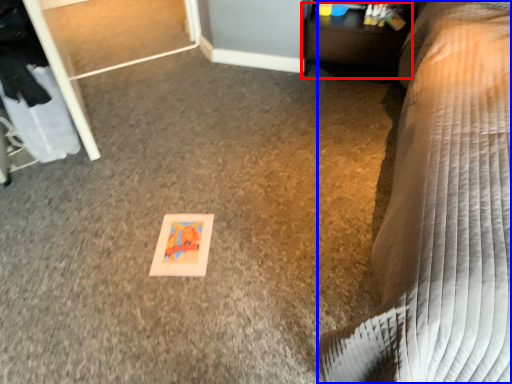
Question: Which point is closer to the camera, table (highlighted by a red box) or furniture (highlighted by a blue box)?

Choices:
 (A) table
 (B) furniture

Answer: (B)